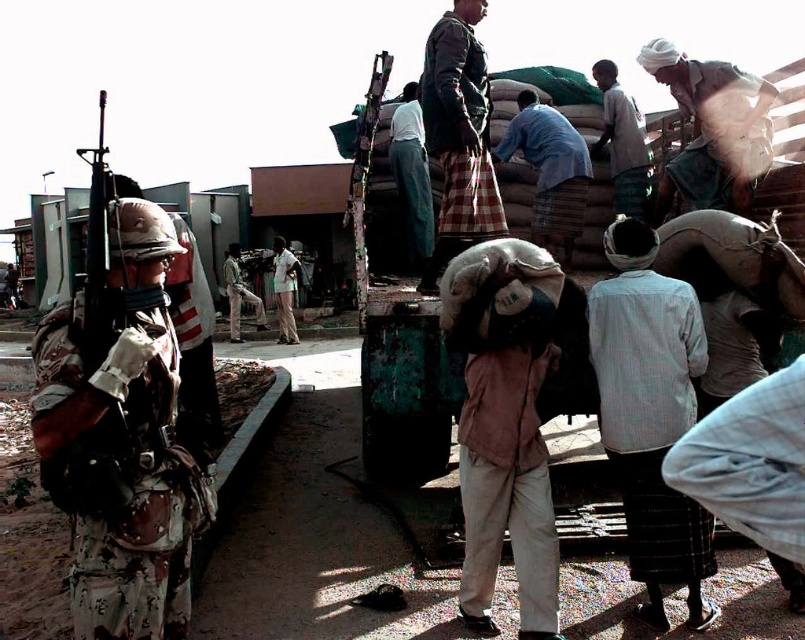
Question: Based on their relative distances, which object is nearer to the light blue striped shirt at center?

Choices:
 (A) camouflage uniform at center
 (B) white cotton shirt at center

Answer: (B)

Question: Is plaid fabric bag at center positioned behind blue cotton shirt at center?

Choices:
 (A) no
 (B) yes

Answer: (A)

Question: Which of the following is the closest to the observer?

Choices:
 (A) (547, 145)
 (B) (420, 166)

Answer: (A)

Question: Can you confirm if light blue striped shirt at center is bigger than plaid fabric bag at center?

Choices:
 (A) no
 (B) yes

Answer: (A)

Question: Is camouflage fabric uniform at left to the left of plaid fabric bag at center from the viewer's perspective?

Choices:
 (A) no
 (B) yes

Answer: (B)

Question: Which is nearer to the camouflage uniform at center?

Choices:
 (A) white cotton shirt at center
 (B) blue cotton shirt at center
 (C) light blue fabric pants at center

Answer: (A)